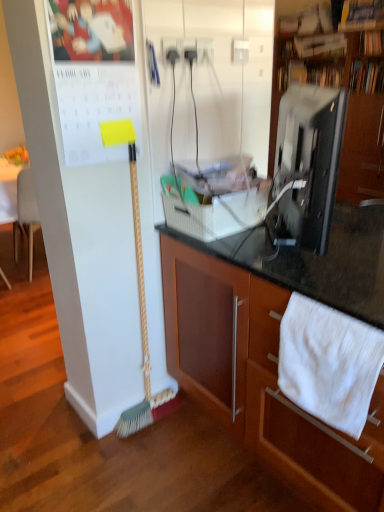
Question: From a real-world perspective, is green bristle broom at left beneath black glossy monitor at upper right?

Choices:
 (A) no
 (B) yes

Answer: (B)

Question: Is green bristle broom at left turned away from black glossy monitor at upper right?

Choices:
 (A) yes
 (B) no

Answer: (B)

Question: From the image's perspective, would you say green bristle broom at left is positioned over black glossy monitor at upper right?

Choices:
 (A) no
 (B) yes

Answer: (A)

Question: Considering the relative sizes of green bristle broom at left and black glossy monitor at upper right in the image provided, is green bristle broom at left thinner than black glossy monitor at upper right?

Choices:
 (A) yes
 (B) no

Answer: (A)

Question: From a real-world perspective, is green bristle broom at left physically above black glossy monitor at upper right?

Choices:
 (A) yes
 (B) no

Answer: (B)

Question: Considering the positions of point (306, 58) and point (370, 286), is point (306, 58) closer or farther from the camera than point (370, 286)?

Choices:
 (A) closer
 (B) farther

Answer: (B)

Question: Relative to wooden cabinet at center, which ranks as the 1th cabinetry in front-to-back order, is black glossy cabinet at upper right, which is the first cabinetry from back to front, in front or behind?

Choices:
 (A) front
 (B) behind

Answer: (B)

Question: From the image's perspective, is black glossy cabinet at upper right, positioned as the second cabinetry in bottom-to-top order, positioned above or below wooden cabinet at center, the 2th cabinetry in the back-to-front sequence?

Choices:
 (A) above
 (B) below

Answer: (A)

Question: In terms of size, does black glossy cabinet at upper right, positioned as the second cabinetry in bottom-to-top order, appear bigger or smaller than wooden cabinet at center, the 2th cabinetry in the back-to-front sequence?

Choices:
 (A) big
 (B) small

Answer: (A)

Question: Is point (339, 466) positioned closer to the camera than point (359, 355)?

Choices:
 (A) farther
 (B) closer

Answer: (A)

Question: Is wooden cabinet at center, acting as the second cabinetry starting from the top, spatially inside white cotton towel at lower right, or outside of it?

Choices:
 (A) outside
 (B) inside

Answer: (A)

Question: In terms of size, does wooden cabinet at center, acting as the second cabinetry starting from the top, appear bigger or smaller than white cotton towel at lower right?

Choices:
 (A) small
 (B) big

Answer: (B)

Question: Considering the positions of wooden cabinet at center, which is the 1th cabinetry from bottom to top, and white cotton towel at lower right in the image, is wooden cabinet at center, which is the 1th cabinetry from bottom to top, wider or thinner than white cotton towel at lower right?

Choices:
 (A) thin
 (B) wide

Answer: (B)

Question: Based on their positions, is white cotton towel at lower right located to the left or right of green bristle broom at left?

Choices:
 (A) right
 (B) left

Answer: (A)

Question: Is point (299, 295) closer or farther from the camera than point (145, 342)?

Choices:
 (A) farther
 (B) closer

Answer: (B)